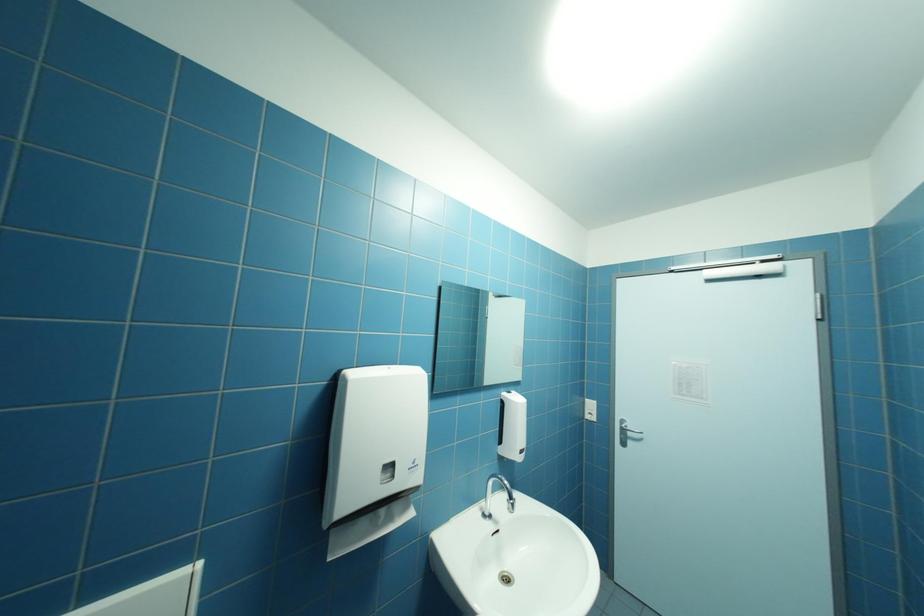
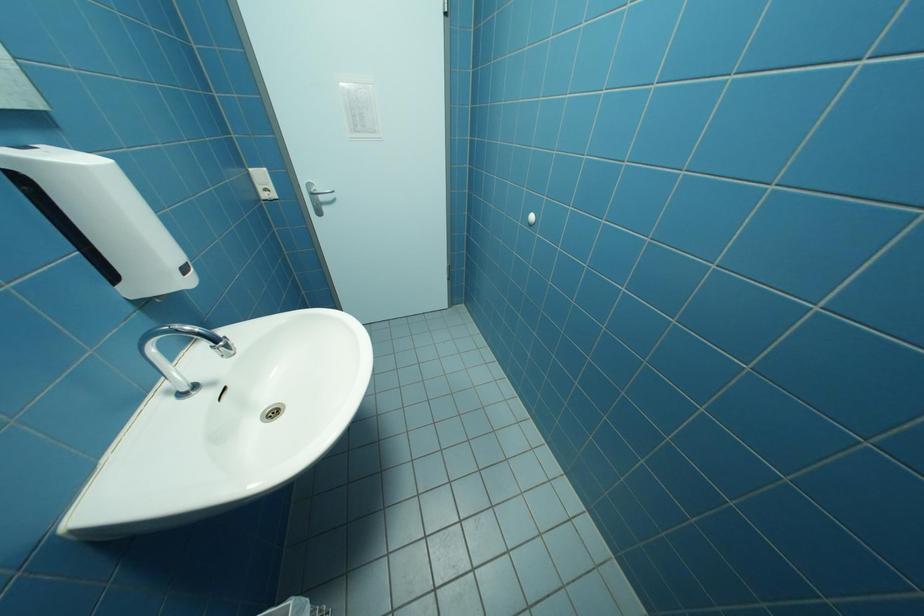
The images are taken continuously from a first-person perspective. In which direction is your viewpoint rotating?

The rotation direction of the camera is right-down.